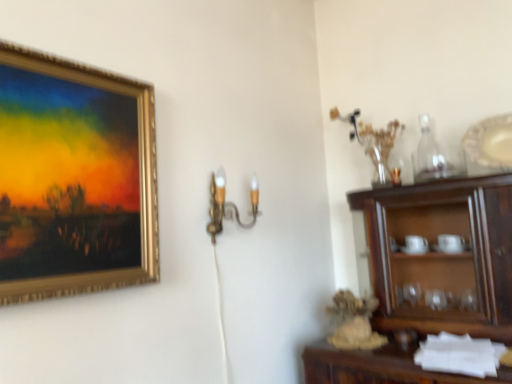
Question: Can you confirm if gold metallic picture frame at upper left is wider than white glossy platter at upper right?

Choices:
 (A) yes
 (B) no

Answer: (B)

Question: Is gold metallic picture frame at upper left with white glossy platter at upper right?

Choices:
 (A) yes
 (B) no

Answer: (B)

Question: Is gold metallic picture frame at upper left not close to white glossy platter at upper right?

Choices:
 (A) no
 (B) yes

Answer: (B)

Question: Is gold metallic picture frame at upper left turned away from white glossy platter at upper right?

Choices:
 (A) yes
 (B) no

Answer: (B)

Question: From a real-world perspective, is gold metallic picture frame at upper left on white glossy platter at upper right?

Choices:
 (A) yes
 (B) no

Answer: (B)

Question: Considering the relative sizes of gold metallic picture frame at upper left and white glossy platter at upper right in the image provided, is gold metallic picture frame at upper left thinner than white glossy platter at upper right?

Choices:
 (A) no
 (B) yes

Answer: (B)

Question: Can you confirm if clear glass bottle at upper right is smaller than gold metallic picture frame at upper left?

Choices:
 (A) no
 (B) yes

Answer: (B)

Question: Is clear glass bottle at upper right positioned far away from gold metallic picture frame at upper left?

Choices:
 (A) no
 (B) yes

Answer: (B)

Question: Is clear glass bottle at upper right shorter than gold metallic picture frame at upper left?

Choices:
 (A) no
 (B) yes

Answer: (B)

Question: Does clear glass bottle at upper right come in front of gold metallic picture frame at upper left?

Choices:
 (A) yes
 (B) no

Answer: (B)

Question: Can you confirm if clear glass bottle at upper right is wider than gold metallic picture frame at upper left?

Choices:
 (A) yes
 (B) no

Answer: (B)

Question: Is clear glass bottle at upper right oriented towards gold metallic picture frame at upper left?

Choices:
 (A) no
 (B) yes

Answer: (A)

Question: Does gold metallic picture frame at upper left have a greater height compared to gold metallic wall sconce at center?

Choices:
 (A) no
 (B) yes

Answer: (B)